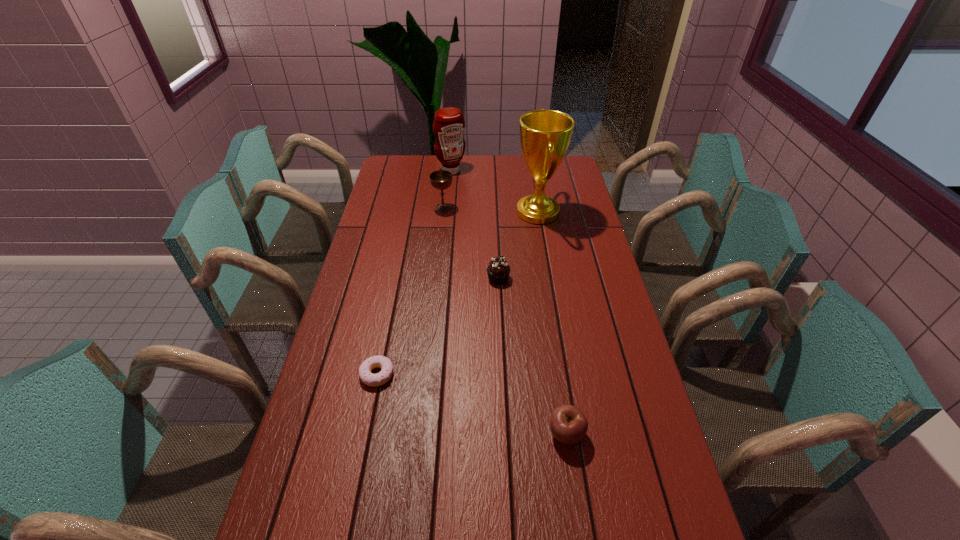
Find the location of a particular element. This screenshot has width=960, height=540. free space located 0.290m by the handles of the tallest object is located at coordinates pos(442,212).

At what (x,y) coordinates should I click in order to perform the action: click on blank space located 0.330m by the handles of the tallest object. Please return your answer as a coordinate pair (x, y). Looking at the image, I should click on (432, 212).

You are a GUI agent. You are given a task and a screenshot of the screen. Output one action in this format:
    pyautogui.click(x=<x>, y=<y>)
    Task: Click on the free space located 0.170m on the front of the second tallest object
    The width and height of the screenshot is (960, 540).
    Given the screenshot: What is the action you would take?
    pyautogui.click(x=448, y=198)

This screenshot has height=540, width=960. Find the location of `free spot located 0.210m on the back of the third tallest object`. free spot located 0.210m on the back of the third tallest object is located at coordinates (x=446, y=176).

Where is `free point located 0.280m on the right of the cupcake`? Image resolution: width=960 pixels, height=540 pixels. free point located 0.280m on the right of the cupcake is located at coordinates (592, 279).

Find the location of `blank space located 0.100m on the side of the nearest object with the unique marking`. blank space located 0.100m on the side of the nearest object with the unique marking is located at coordinates (576, 495).

Locate an element on the screen. vacant position located on the right of the second nearest object is located at coordinates (441, 375).

Find the location of a particular element. Image resolution: width=960 pixels, height=540 pixels. object that is positioned at the far edge is located at coordinates (448, 125).

Locate an element on the screen. The image size is (960, 540). object present at the left edge is located at coordinates (368, 378).

Identify the location of object located in the right edge section of the desktop. (545, 135).